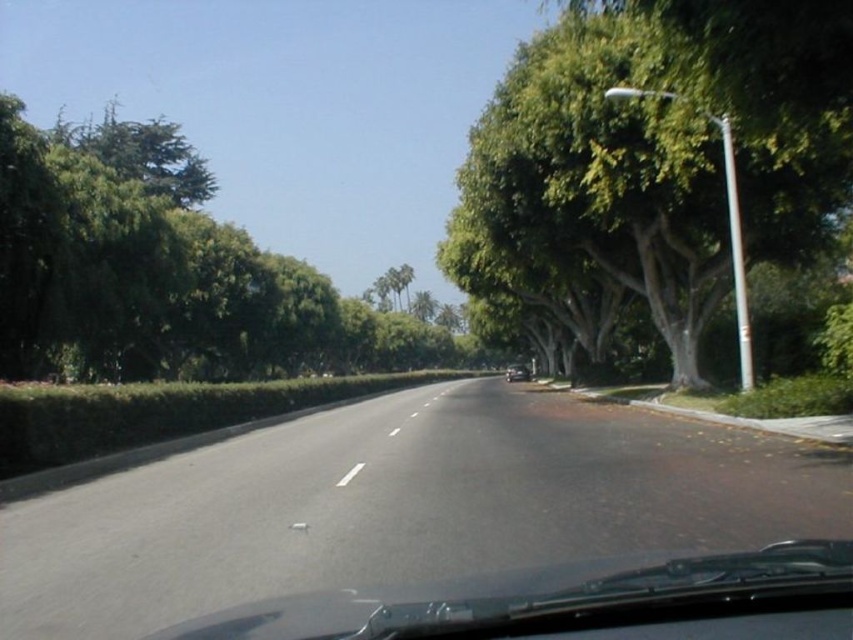
You are driving along the tree lined street and see two points on the road ahead. The first point is at coordinates point (x=486, y=285) and the second is at point (x=363, y=310). Which point is closer to your current position?

Point (x=486, y=285) is in front of point (x=363, y=310), so the closer point to your current position would be point (x=363, y=310).

You are driving along the tree lined street and want to know where the green leafy tree at right is located in the image. Please describe its position using the coordinate system provided in the Objects Description.

The green leafy tree at right is located at the 2D coordinate point of (659,156) as per the Objects Description.

You are driving along the road and notice a green leafy tree at right and a white glossy line at center. Which one is positioned more to the right side of the road?

The green leafy tree at right is positioned more to the right side of the road than the white glossy line at center.